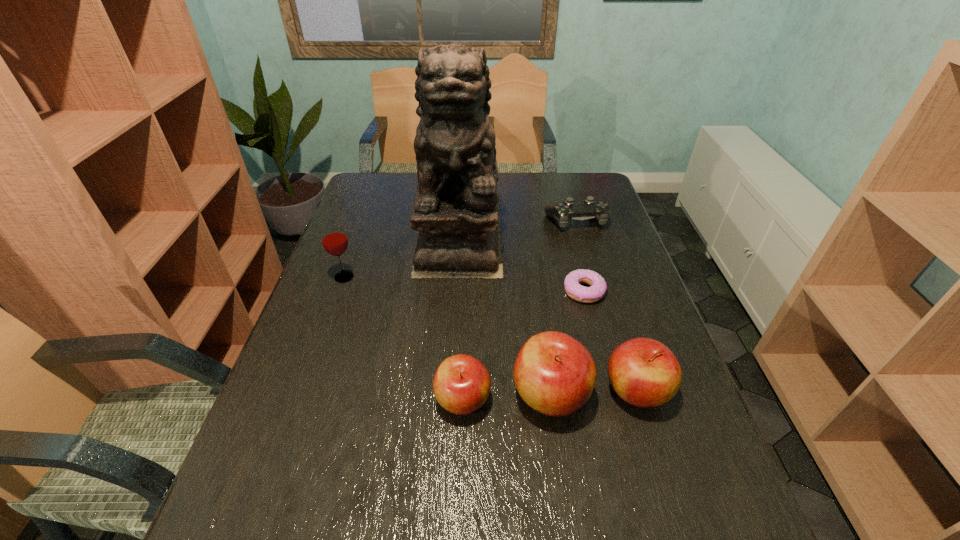
Where is `blank area in the image that satisfies the following two spatial constraints: 1. on the front-facing side of the fourth tallest object; 2. on the right side of the tallest object`? The image size is (960, 540). blank area in the image that satisfies the following two spatial constraints: 1. on the front-facing side of the fourth tallest object; 2. on the right side of the tallest object is located at coordinates (450, 391).